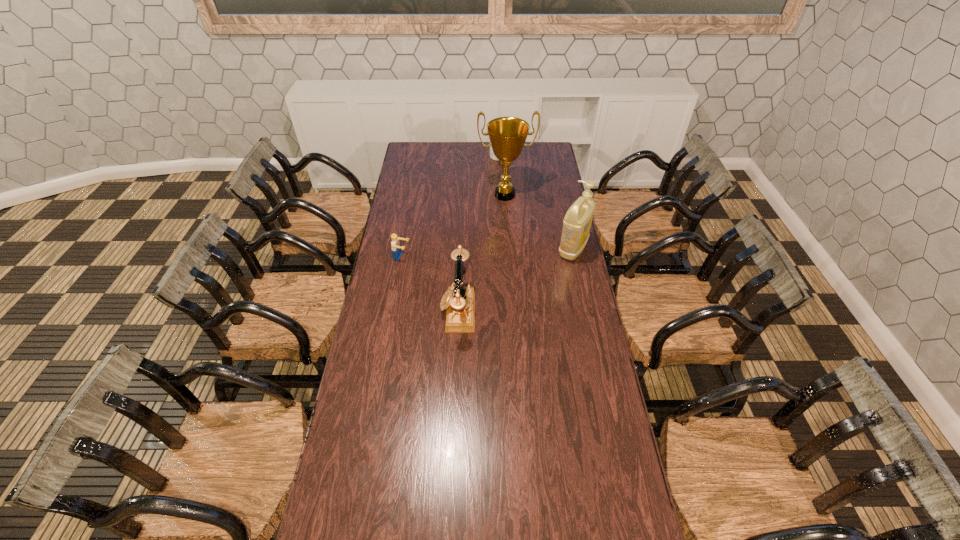
Where is `free spot on the desktop that is between the second object from left to right and the second tallest object and is positioned with the handle on the side of the farthest object`? This screenshot has width=960, height=540. free spot on the desktop that is between the second object from left to right and the second tallest object and is positioned with the handle on the side of the farthest object is located at coordinates click(x=525, y=275).

This screenshot has height=540, width=960. Find the location of `vacant space on the desktop that is between the fourth object from right to left and the second tallest object and is positioned on the face of the leftmost object`. vacant space on the desktop that is between the fourth object from right to left and the second tallest object and is positioned on the face of the leftmost object is located at coordinates (516, 280).

Image resolution: width=960 pixels, height=540 pixels. I want to click on free space on the desktop that is between the telephone and the second tallest object and is positioned on the front view with handles of the tallest object, so click(x=514, y=281).